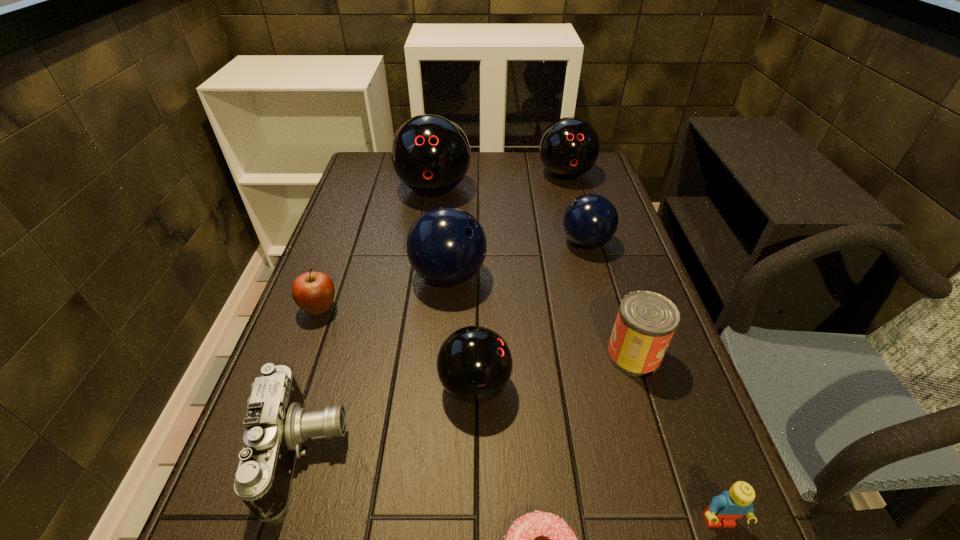
Locate which bowling ball is the closest to the biggest black bowling ball. Please provide its 2D coordinates. Your answer should be formatted as a tuple, i.e. [(x, y)], where the tuple contains the x and y coordinates of a point satisfying the conditions above.

[(446, 246)]

Locate an element on the screen. the second closest black bowling ball to the rightmost black bowling ball is located at coordinates (474, 364).

Choose which black bowling ball is the third nearest neighbor to the left blue bowling ball. Please provide its 2D coordinates. Your answer should be formatted as a tuple, i.e. [(x, y)], where the tuple contains the x and y coordinates of a point satisfying the conditions above.

[(569, 147)]

At what (x,y) coordinates should I click in order to perform the action: click on free space in the image that satisfies the following two spatial constraints: 1. on the surface of the smaller blue bowling ball near the finger holes; 2. on the back side of the can. Please return your answer as a coordinate pair (x, y). Looking at the image, I should click on (617, 355).